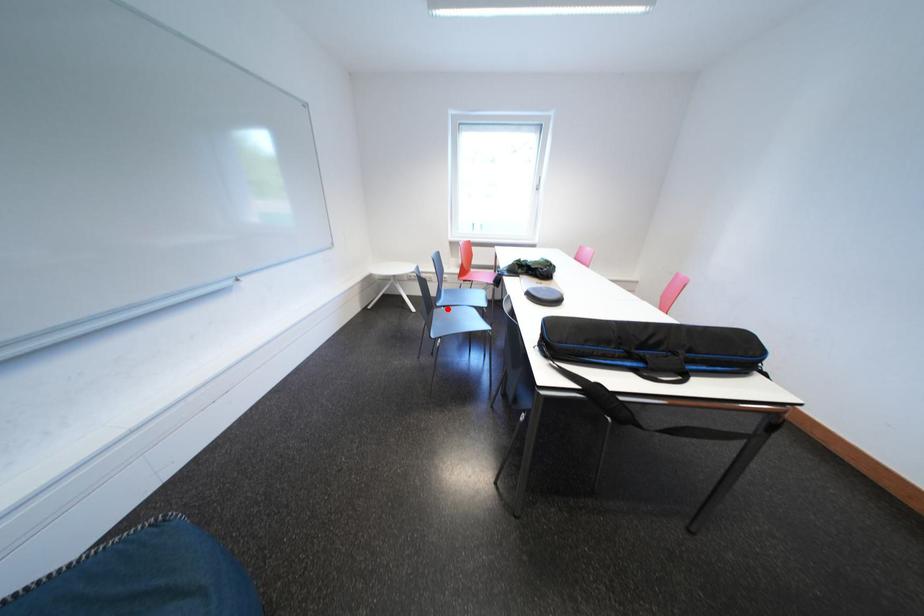
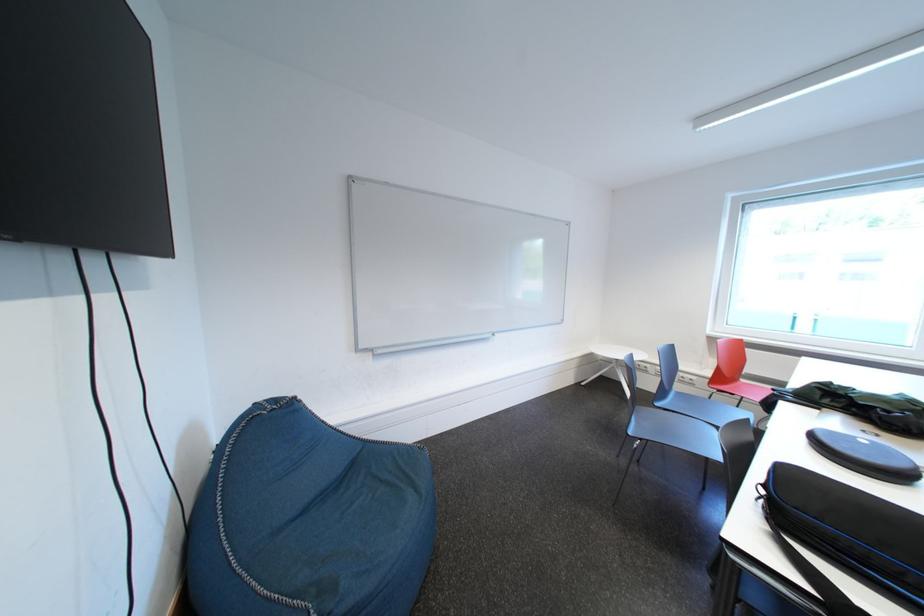
Question: A red point is marked in image1. In image2, is the corresponding 3D point closer to the camera or farther? Reply with the corresponding letter.

Choices:
 (A) The corresponding 3D point is closer.
 (B) The corresponding 3D point is farther.

Answer: (A)